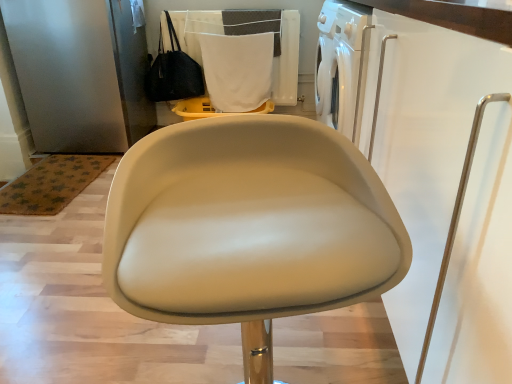
Question: Considering the relative sizes of beige leather chair at center and black leather handbag at upper left in the image provided, is beige leather chair at center thinner than black leather handbag at upper left?

Choices:
 (A) no
 (B) yes

Answer: (A)

Question: Considering the relative positions of beige leather chair at center and black leather handbag at upper left in the image provided, is beige leather chair at center to the left of black leather handbag at upper left from the viewer's perspective?

Choices:
 (A) no
 (B) yes

Answer: (A)

Question: Considering the relative sizes of beige leather chair at center and black leather handbag at upper left in the image provided, is beige leather chair at center smaller than black leather handbag at upper left?

Choices:
 (A) no
 (B) yes

Answer: (A)

Question: Considering the relative sizes of beige leather chair at center and black leather handbag at upper left in the image provided, is beige leather chair at center taller than black leather handbag at upper left?

Choices:
 (A) no
 (B) yes

Answer: (B)

Question: Does beige leather chair at center come behind black leather handbag at upper left?

Choices:
 (A) yes
 (B) no

Answer: (B)

Question: Can you confirm if beige leather chair at center is positioned to the right of black leather handbag at upper left?

Choices:
 (A) yes
 (B) no

Answer: (A)

Question: Is white fabric laundry at upper center touching white fabric at upper center?

Choices:
 (A) yes
 (B) no

Answer: (B)

Question: From the image's perspective, is white fabric laundry at upper center over white fabric at upper center?

Choices:
 (A) no
 (B) yes

Answer: (B)

Question: Is white fabric laundry at upper center facing away from white fabric at upper center?

Choices:
 (A) no
 (B) yes

Answer: (B)

Question: Can you confirm if white fabric laundry at upper center is taller than white fabric at upper center?

Choices:
 (A) no
 (B) yes

Answer: (A)

Question: From the image's perspective, is white fabric laundry at upper center beneath white fabric at upper center?

Choices:
 (A) yes
 (B) no

Answer: (B)

Question: Considering the relative positions of white fabric laundry at upper center and white fabric at upper center in the image provided, is white fabric laundry at upper center to the left of white fabric at upper center from the viewer's perspective?

Choices:
 (A) yes
 (B) no

Answer: (A)

Question: From the image's perspective, is black leather handbag at upper left under beige leather chair at center?

Choices:
 (A) no
 (B) yes

Answer: (A)